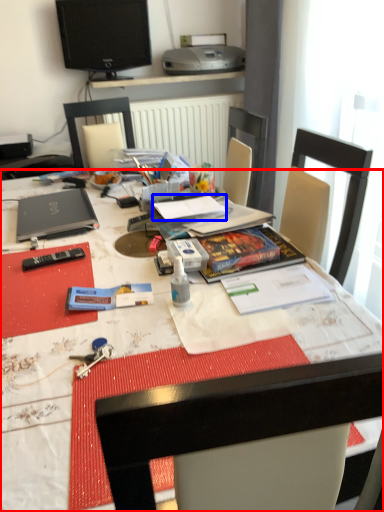
Question: Among these objects, which one is nearest to the camera, desk (highlighted by a red box) or notebook (highlighted by a blue box)?

Choices:
 (A) desk
 (B) notebook

Answer: (A)